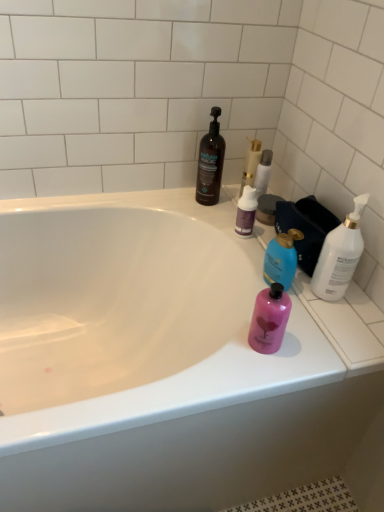
The image size is (384, 512). Identify the location of vacant space in between pink matte bottle at right, marked as the third bottle in a left-to-right arrangement, and white glossy bottle at right, which appears as the 5th bottle when viewed from the left. (304, 316).